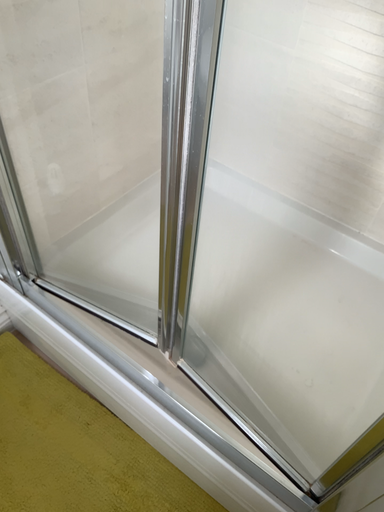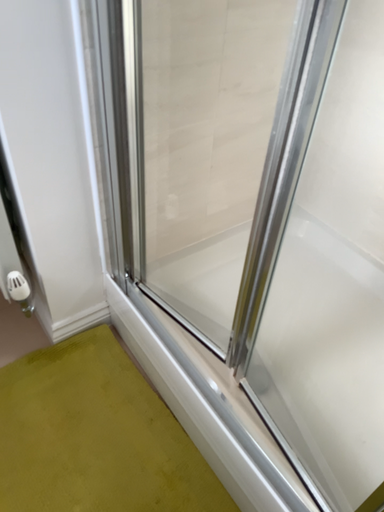
Question: Which way did the camera rotate in the video?

Choices:
 (A) rotated upward
 (B) rotated downward

Answer: (A)